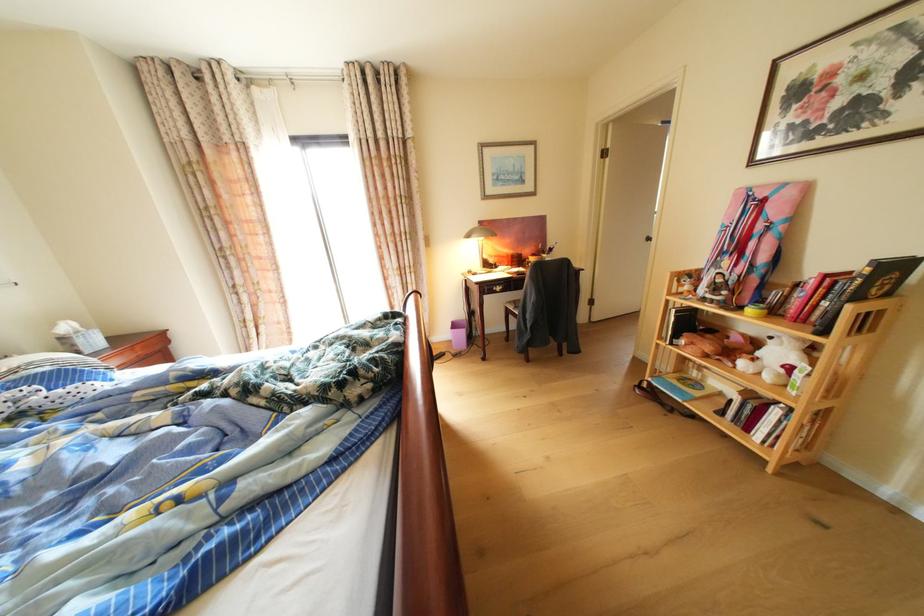
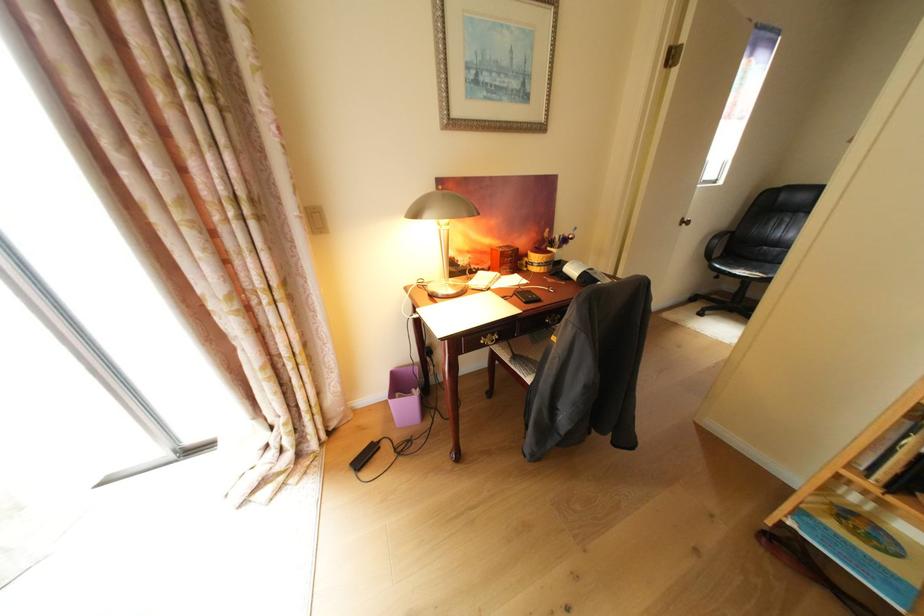
Question: Which direction would the cameraman need to move to produce the second image? Reply with the corresponding letter.

Choices:
 (A) Left
 (B) Right
 (C) Forward
 (D) Backward

Answer: (C)